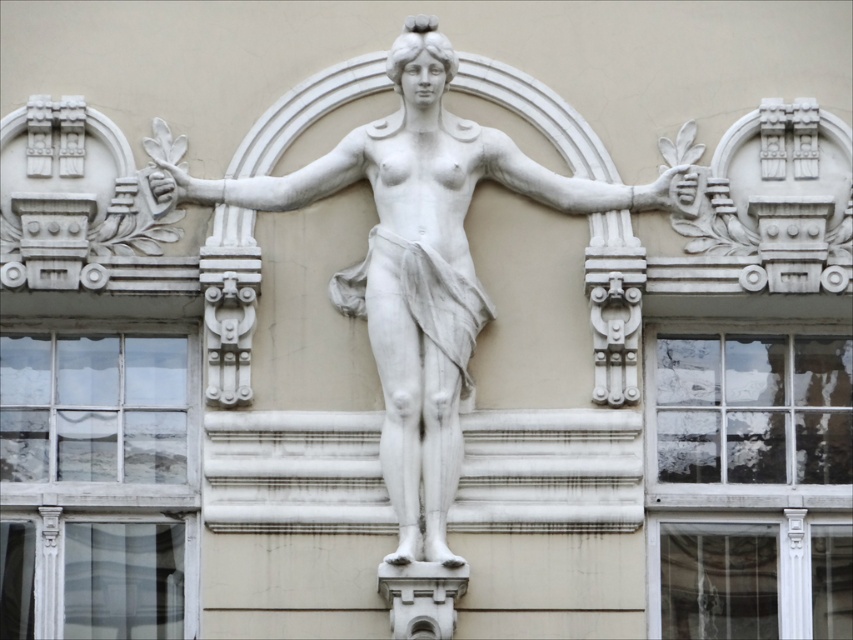
Based on the photo, you are an architect examining the building facade. You notice a point at coordinates [421,264]. What object is located at that point?

The point at coordinates [421,264] is where the white marble statue at center is located.

You are an art conservator assessing the structural integrity of the white marble statue at center and the white stone arm at center. Given that the recommended safe distance between such elements for preservation purposes is at least 5 meters, is the current spacing between them within the recommended guidelines?

The white marble statue at center is 4.65 meters from the white stone arm at center, which is below the recommended safe distance of 5 meters. Therefore, the current spacing does not meet the preservation guidelines.